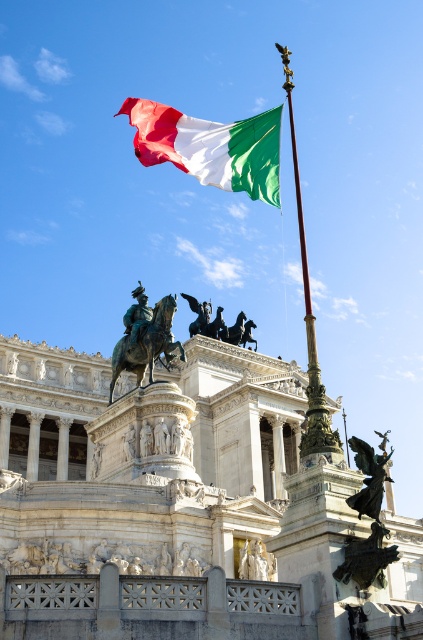
You are an art student standing in front of the polished bronze statue at lower right and the matte white statue at lower center. Which statue is closer to you?

The polished bronze statue at lower right is closer to you because it is in front of the matte white statue at lower center.

You are standing at the base of the flagpole in the image and want to walk towards the statue of the man on horseback. Which direction should you move relative to the two points shown at coordinates point [128,337] and point [271,557]?

Since point [128,337] is behind point [271,557], you should move towards the direction of point [271,557] to reach the statue of the man on horseback as it is closer to your starting position at the flagpole.